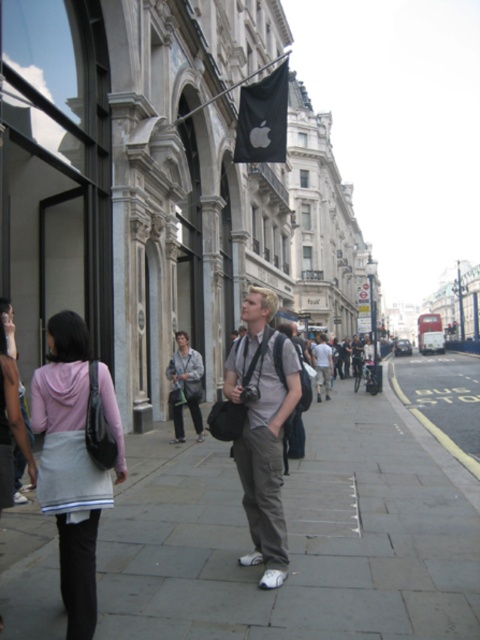
You are standing on the sidewalk in front of the classical European buildings. There is a point marked at coordinates (263, 118). What object is located at that point?

The point at coordinates (263, 118) marks the location of the black fabric flag at upper center.